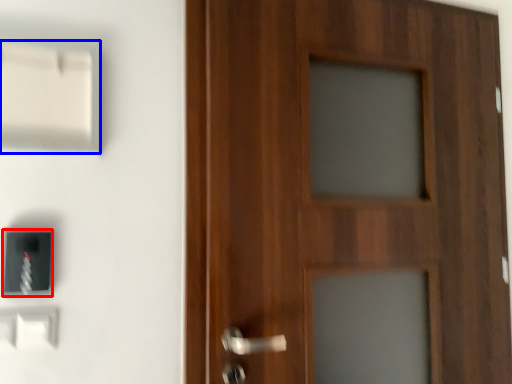
Question: Which object appears closest to the camera in this image, light switch (highlighted by a red box) or light switch (highlighted by a blue box)?

Choices:
 (A) light switch
 (B) light switch

Answer: (B)